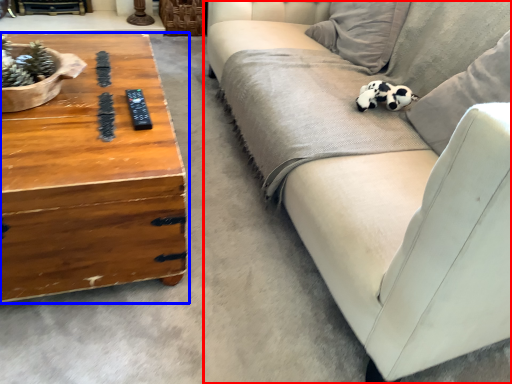
Question: Among these objects, which one is nearest to the camera, studio couch (highlighted by a red box) or coffee table (highlighted by a blue box)?

Choices:
 (A) studio couch
 (B) coffee table

Answer: (B)